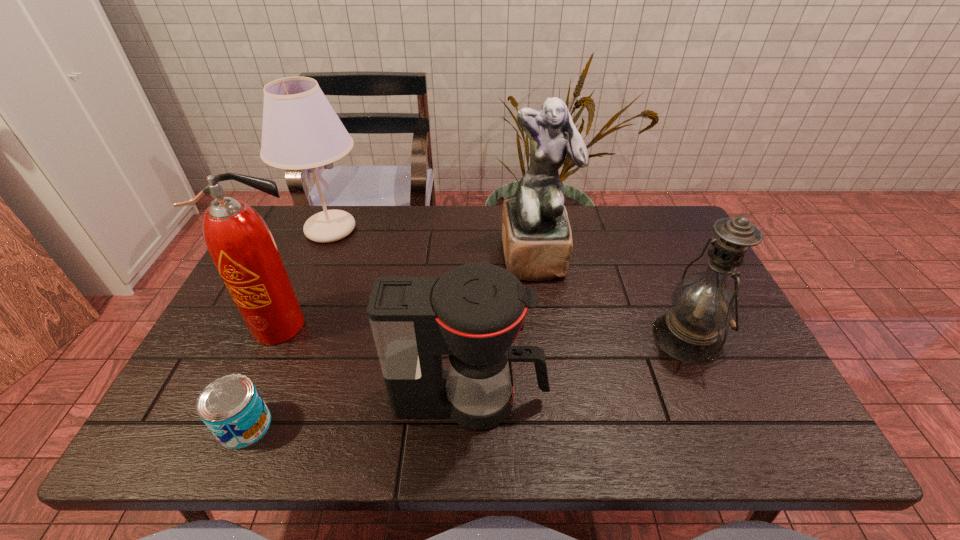
Find the location of a particular element. lampshade is located at coordinates (300, 130).

The height and width of the screenshot is (540, 960). I want to click on sculpture, so click(x=537, y=241).

Find the location of a particular element. The height and width of the screenshot is (540, 960). fire extinguisher is located at coordinates (241, 245).

The image size is (960, 540). Identify the location of oil lamp. (703, 303).

Identify the location of coffee maker. Image resolution: width=960 pixels, height=540 pixels. (473, 313).

Locate an element on the screen. can is located at coordinates (231, 407).

Locate an element on the screen. This screenshot has width=960, height=540. vacant space located on the front of the lampshade is located at coordinates (290, 327).

The image size is (960, 540). Identify the location of free location located in a relaxed pose on the sculpture. (556, 395).

Locate an element on the screen. Image resolution: width=960 pixels, height=540 pixels. vacant position located on the right of the fire extinguisher is located at coordinates (470, 326).

The image size is (960, 540). Identify the location of vacant space situated 0.160m on the front of the oil lamp. (734, 444).